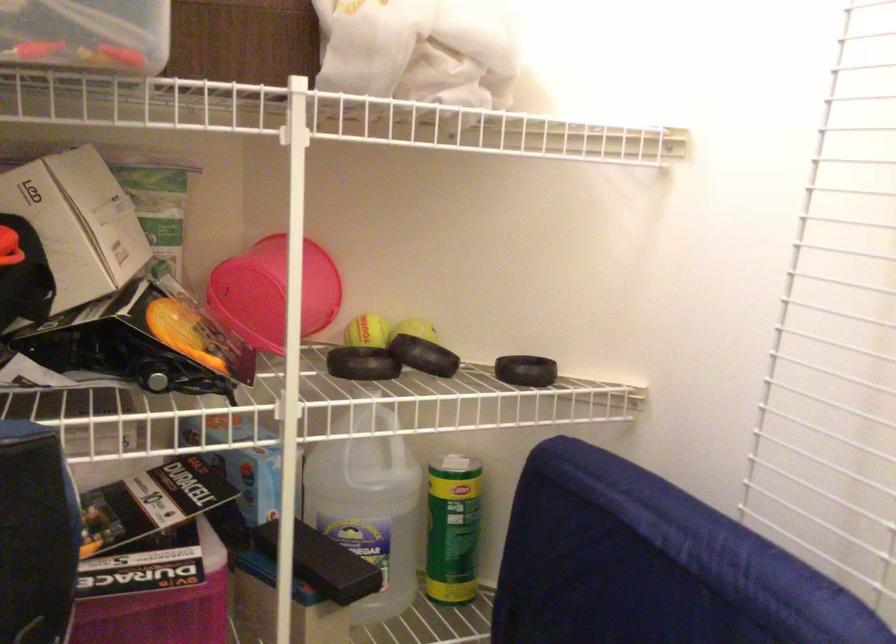
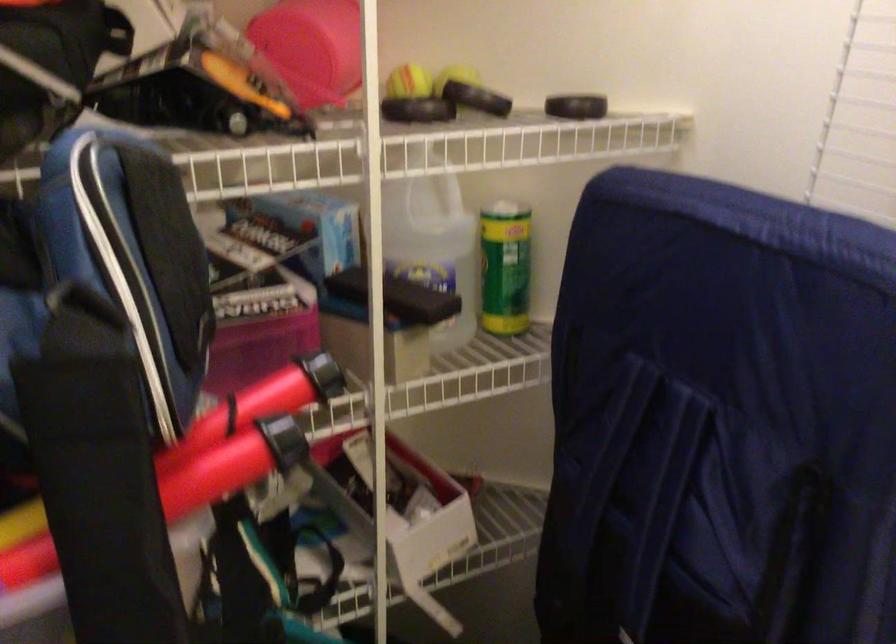
Locate, in the second image, the point that corresponds to point 366,506 in the first image.

(433, 243)